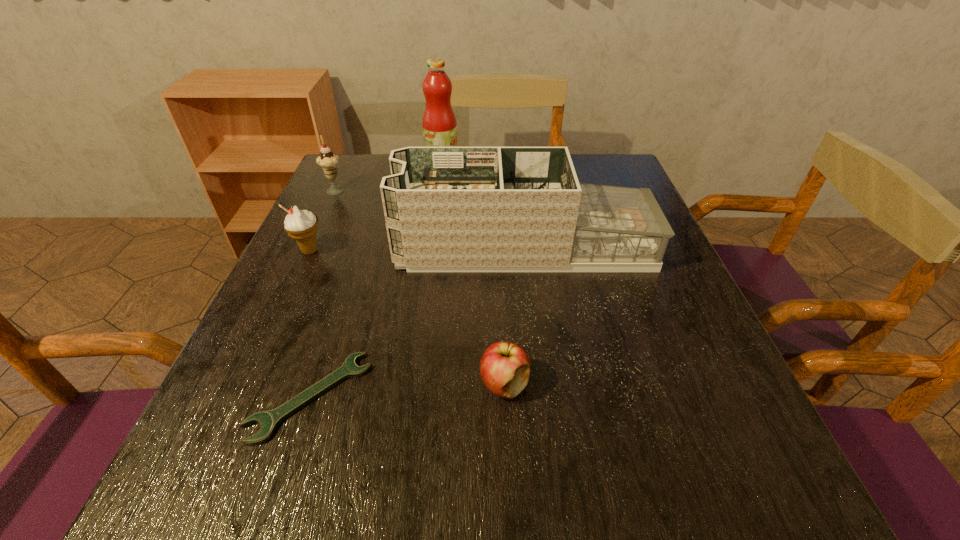
Find the location of a particular element. The height and width of the screenshot is (540, 960). free space that satisfies the following two spatial constraints: 1. on the front side of the apple; 2. on the right side of the fourth tallest object is located at coordinates (x=249, y=384).